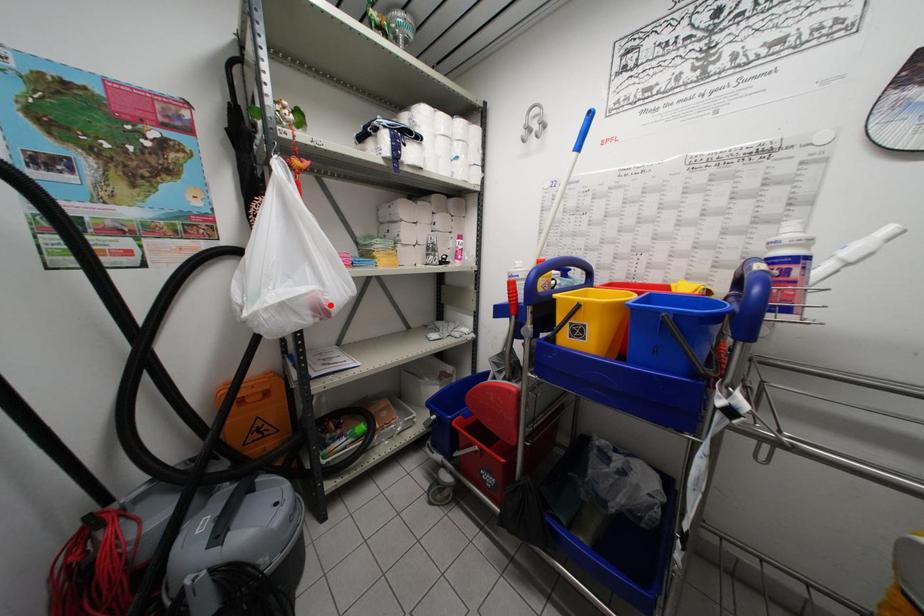
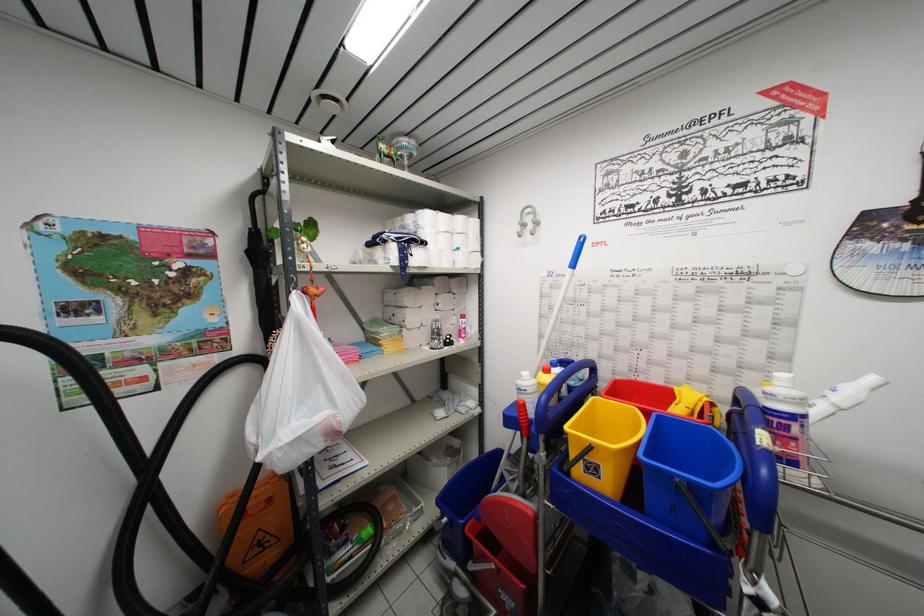
Locate, in the second image, the point that corresponds to the highlighted location in the first image.

(342, 427)